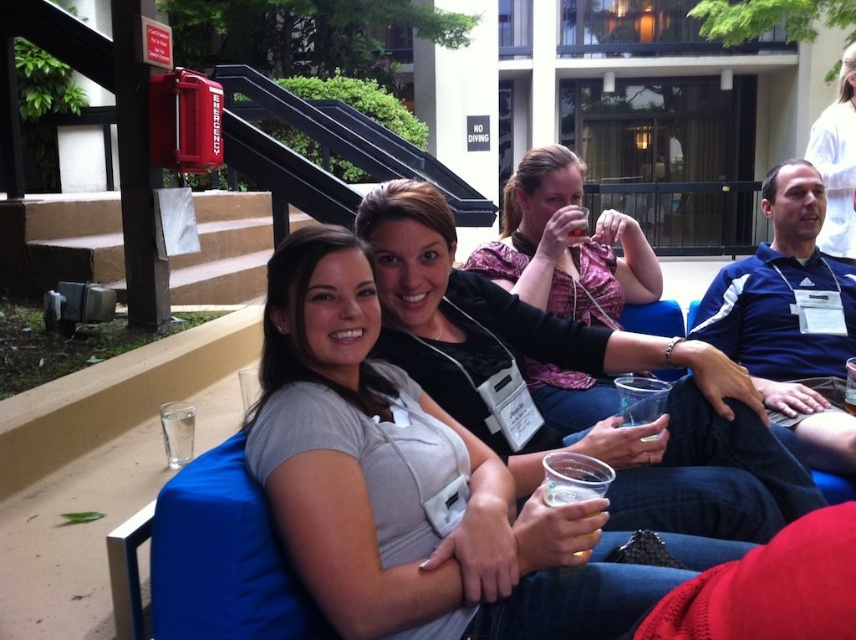
You are standing at the point labeled point (x=27, y=220) and want to move to the point labeled point (x=503, y=252). Which direction should you move to get closer to the camera?

You should move towards point (x=503, y=252) because it is closer to the camera than point (x=27, y=220).

You are a photographer trying to capture a closeup shot of the translucent plastic cup at lower center without including the matte black jacket at center in the frame. Given their sizes, is this possible?

The matte black jacket at center is larger than the translucent plastic cup at lower center, so it might block the view. Adjust your angle to ensure the jacket doesn